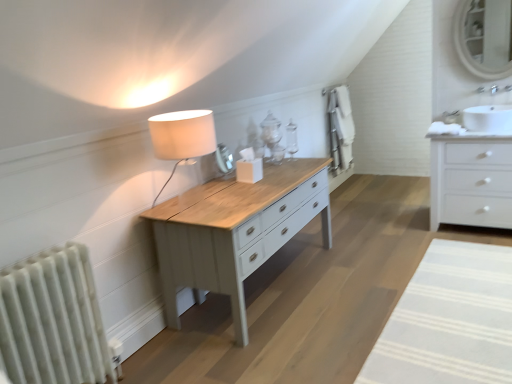
Question: From the image's perspective, is white glossy chest of drawers at right positioned above or below matte white wooden table at center?

Choices:
 (A) above
 (B) below

Answer: (A)

Question: From their relative heights in the image, would you say white glossy chest of drawers at right is taller or shorter than matte white wooden table at center?

Choices:
 (A) short
 (B) tall

Answer: (B)

Question: Based on their relative distances, which object is farther from the matte white wood table lamp at center?

Choices:
 (A) white striped rug at lower right
 (B) white textured radiator at left
 (C) matte white mirror at upper right
 (D) white glossy chest of drawers at right
 (E) white glossy sink at upper right

Answer: (C)

Question: Estimate the real-world distances between objects in this image. Which object is farther from the matte white mirror at upper right?

Choices:
 (A) white glossy chest of drawers at right
 (B) matte white wood table lamp at center
 (C) white striped rug at lower right
 (D) white glossy sink at upper right
 (E) white textured radiator at left

Answer: (E)